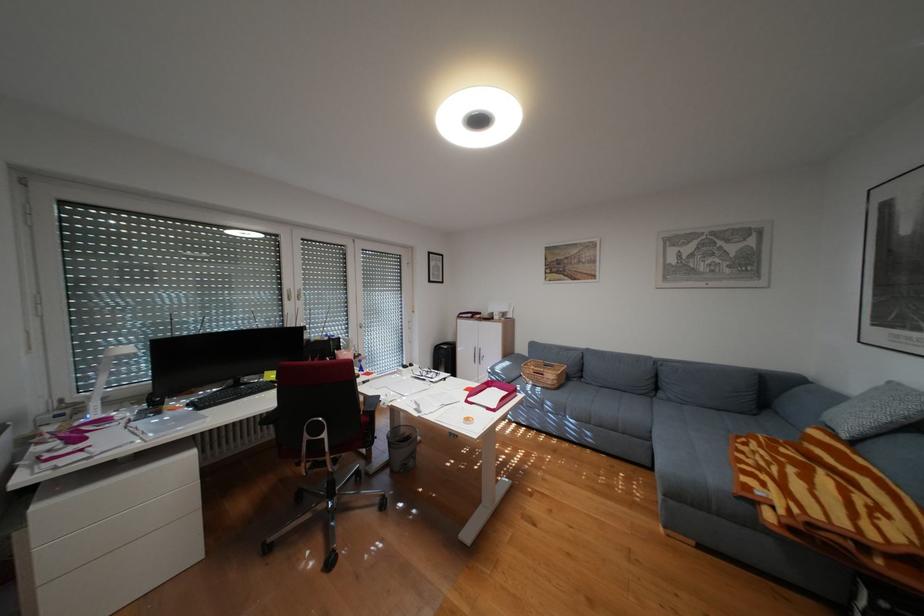
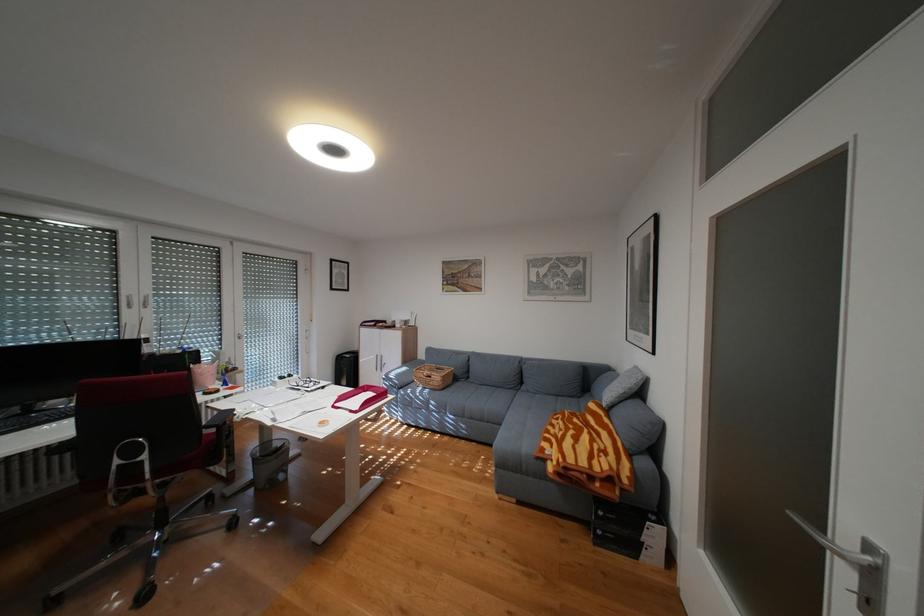
Where in the second image is the point corresponding to point (775, 484) from the first image?

(564, 445)